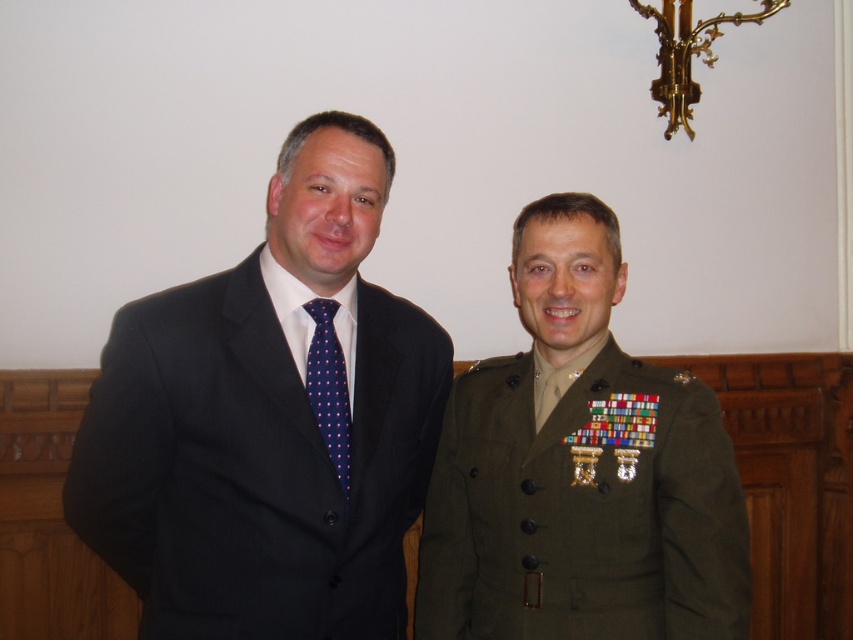
Does matte black suit at left appear over green military uniform at right?

Correct, matte black suit at left is located above green military uniform at right.

You are a GUI agent. You are given a task and a screenshot of the screen. Output one action in this format:
    pyautogui.click(x=<x>, y=<y>)
    Task: Click on the matte black suit at left
    
    Given the screenshot: What is the action you would take?
    pyautogui.click(x=270, y=422)

Can you confirm if matte black suit at left is positioned to the left of dark blue dotted tie at center?

Yes, matte black suit at left is to the left of dark blue dotted tie at center.

Who is more forward, (405, 474) or (328, 369)?

Point (328, 369)

Which is behind, point (113, 371) or point (331, 416)?

Positioned behind is point (331, 416).

In order to click on matte black suit at left in this screenshot , I will do `click(270, 422)`.

Who is taller, green military uniform at right or dark blue dotted tie at center?

Standing taller between the two is green military uniform at right.

Is point (608, 268) positioned behind point (329, 307)?

That is True.

Does point (695, 634) lie in front of point (341, 456)?

That is False.

Image resolution: width=853 pixels, height=640 pixels. What are the coordinates of `green military uniform at right` in the screenshot? It's located at (579, 470).